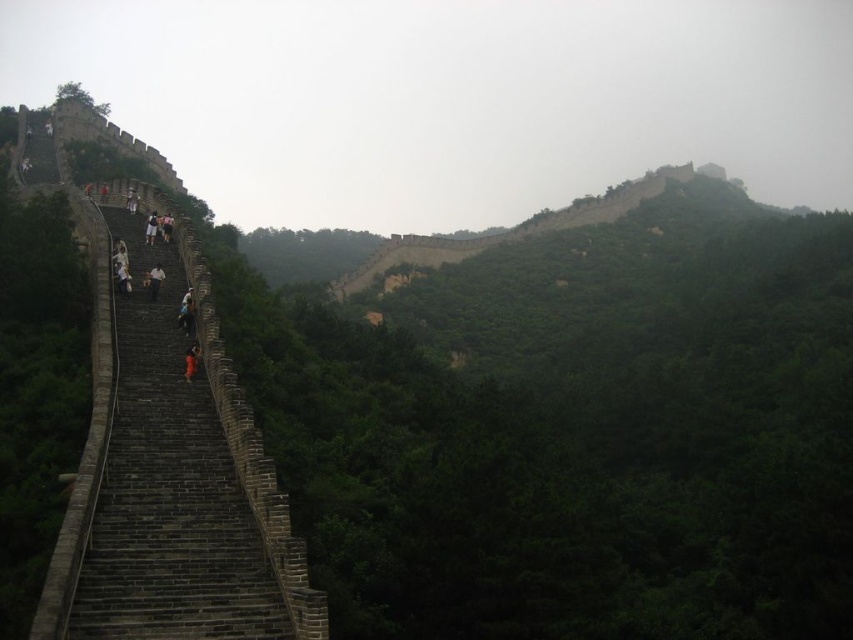
Question: Where is light brown wooden stick at upper left located in relation to orange fabric person at left in the image?

Choices:
 (A) above
 (B) below

Answer: (A)

Question: Which point is closer to the camera?

Choices:
 (A) (123, 552)
 (B) (122, 278)
 (C) (190, 348)

Answer: (A)

Question: Which point appears closest to the camera in this image?

Choices:
 (A) (167, 349)
 (B) (186, 364)
 (C) (125, 285)

Answer: (B)

Question: Is dark gray stone stairs at left further to camera compared to light brown wooden stick at upper left?

Choices:
 (A) yes
 (B) no

Answer: (B)

Question: Observing the image, what is the correct spatial positioning of dark gray stone stairs at left in reference to dark gray stone person at center-left?

Choices:
 (A) above
 (B) below

Answer: (B)

Question: Which of the following is the closest to the observer?

Choices:
 (A) orange fabric person at left
 (B) dark gray stone stairs at left

Answer: (B)